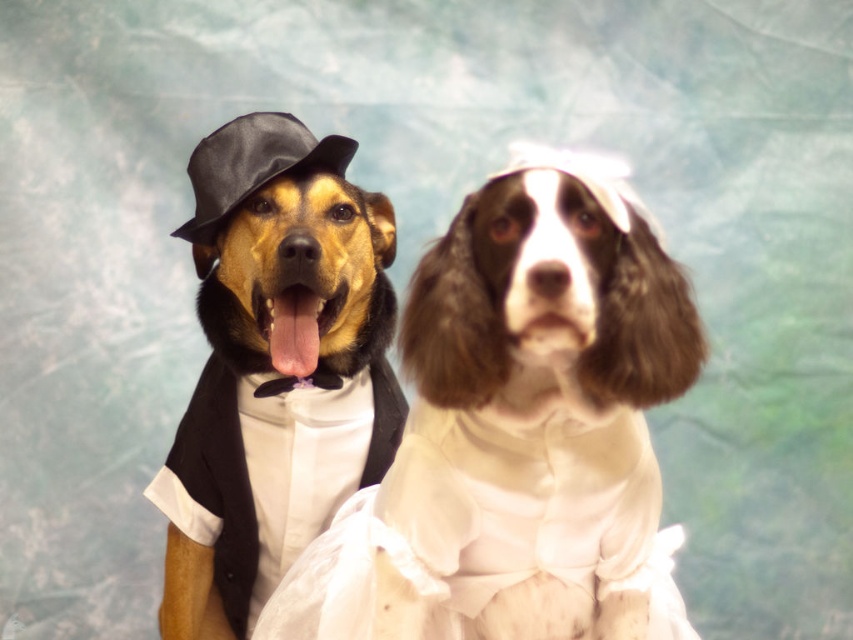
Can you confirm if shiny black hat at left is smaller than white satin dress at center?

Actually, shiny black hat at left might be larger than white satin dress at center.

Does shiny black hat at left appear on the left side of white satin dress at center?

Yes, shiny black hat at left is to the left of white satin dress at center.

At what (x,y) coordinates should I click in order to perform the action: click on shiny black hat at left. Please return your answer as a coordinate pair (x, y). The width and height of the screenshot is (853, 640). Looking at the image, I should click on (276, 368).

Locate an element on the screen. shiny black hat at left is located at coordinates (276, 368).

Is shiny black tuxedo at left positioned at the back of black satin hat at upper left?

No, shiny black tuxedo at left is in front of black satin hat at upper left.

Who is more distant from viewer, (419, 365) or (221, 224)?

The point (221, 224) is behind.

In order to click on shiny black tuxedo at left in this screenshot , I will do `click(519, 429)`.

The image size is (853, 640). I want to click on shiny black tuxedo at left, so [519, 429].

Can you confirm if white satin dress at center is taller than black satin hat at upper left?

Yes, white satin dress at center is taller than black satin hat at upper left.

Between point (289, 625) and point (263, 125), which one is positioned in front?

Point (289, 625) is more forward.

At what (x,y) coordinates should I click in order to perform the action: click on white satin dress at center. Please return your answer as a coordinate pair (x, y). This screenshot has width=853, height=640. Looking at the image, I should click on point(486,531).

Identify the location of white satin dress at center. (486, 531).